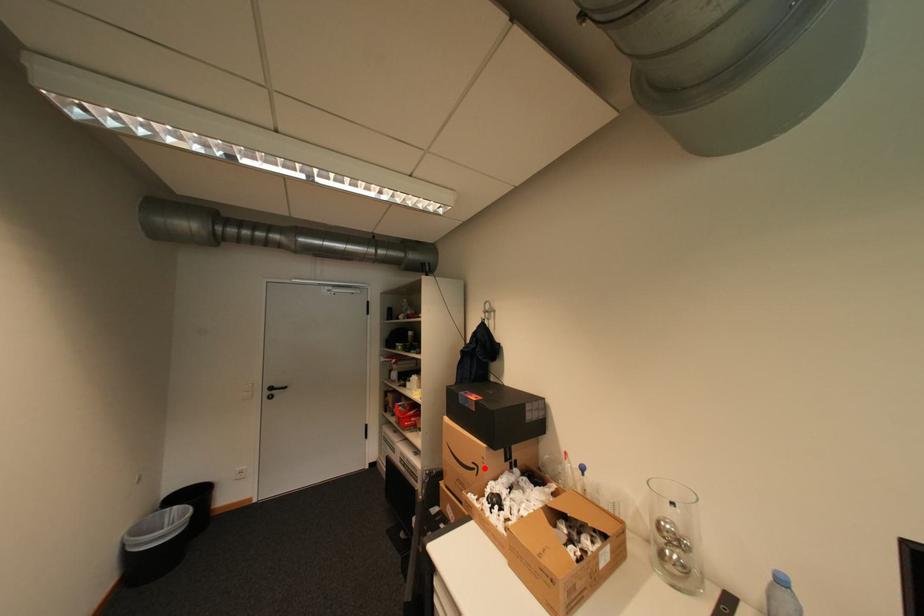
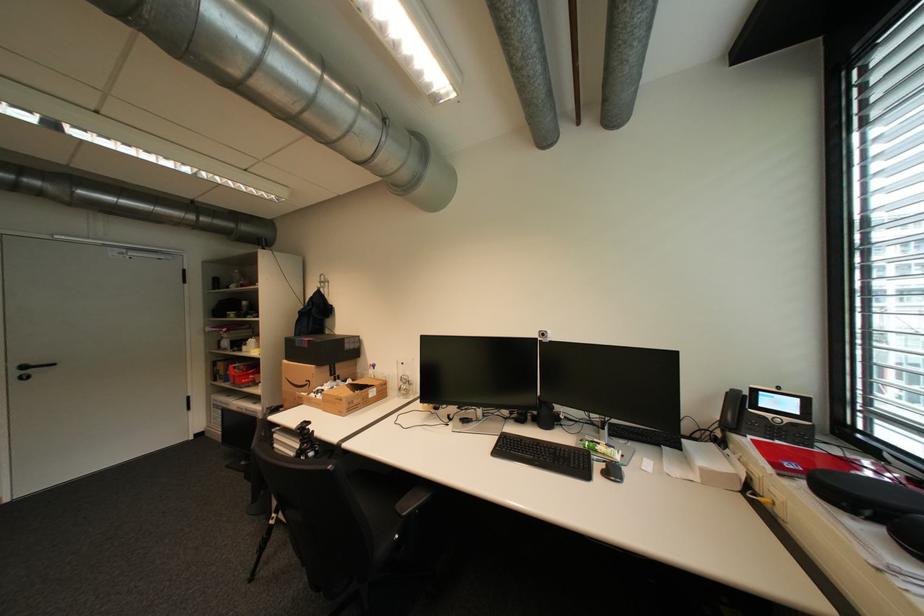
The point at the highlighted location is marked in the first image. Where is the corresponding point in the second image?

(317, 383)